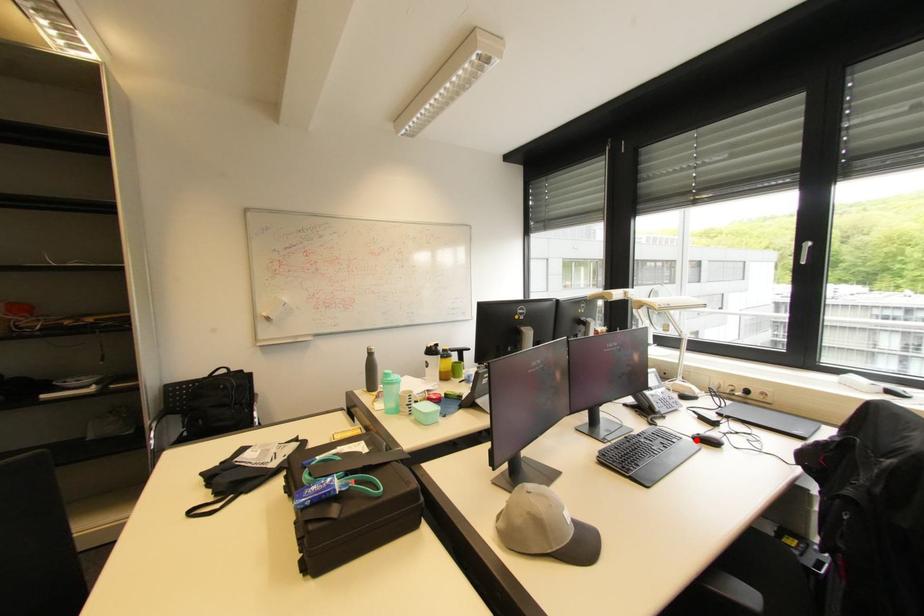
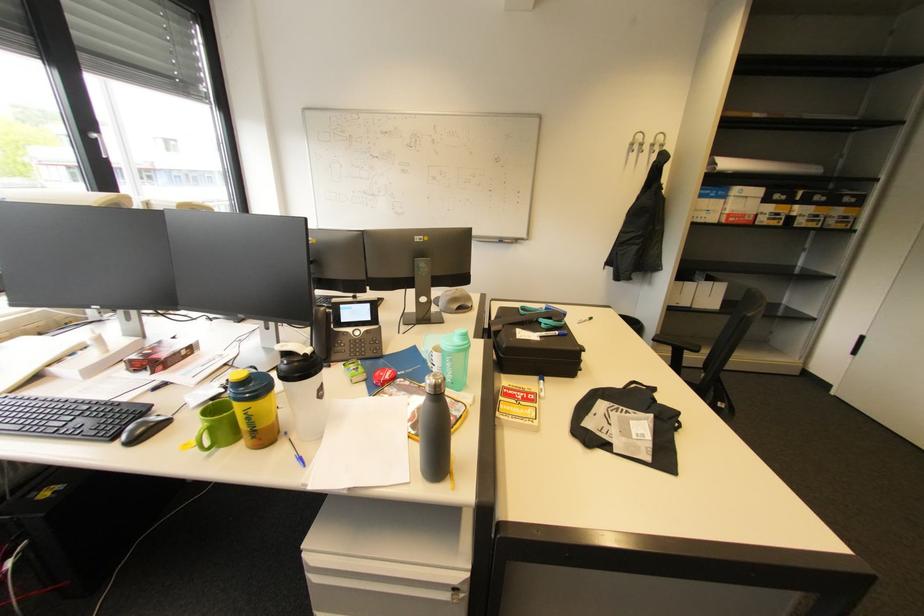
Question: I am providing you with two images of the same scene from different viewpoints. A red point is marked on the first image. At the location where the point appears in image 1, is it still visible in image 2?

Choices:
 (A) Yes
 (B) No

Answer: (B)